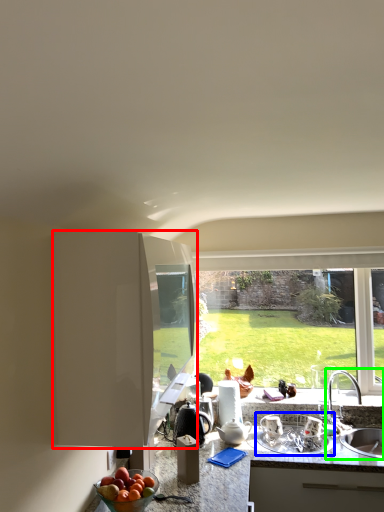
Question: Which object is the farthest from cabinetry (highlighted by a red box)? Choose among these: appliance (highlighted by a blue box) or sink (highlighted by a green box).

Choices:
 (A) appliance
 (B) sink

Answer: (B)